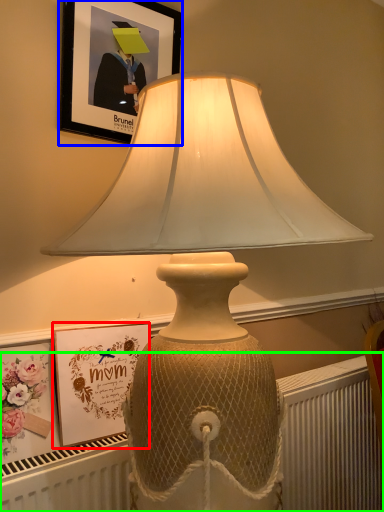
Question: Which object is positioned closest to picture frame (highlighted by a red box)? Select from picture frame (highlighted by a blue box) and radiator (highlighted by a green box).

Choices:
 (A) picture frame
 (B) radiator

Answer: (A)